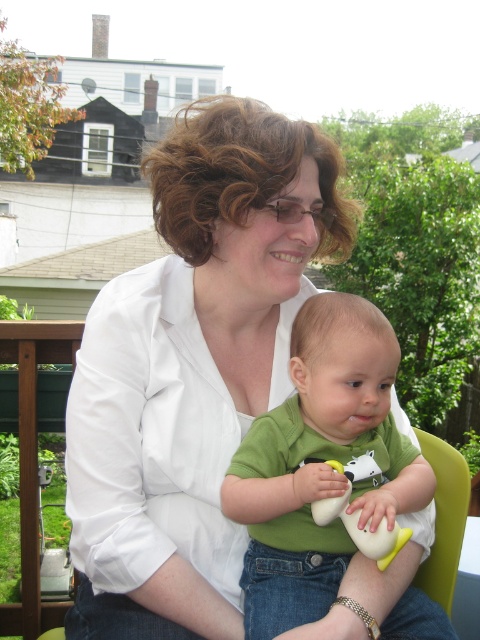
You are a photographer trying to capture a closeup of the white rubber duck at center without the green matte shirt at center blocking it. What should you do?

The green matte shirt at center is in front of the white rubber duck at center, so you should move the green matte shirt at center out of the way or adjust your angle to avoid the obstruction.

You are a photographer trying to capture a photo of the baby. You notice the white smooth shirt at center and the green matte shirt at center in the frame. Which shirt should you adjust to avoid blocking the baby?

The white smooth shirt at center is positioned on the left side of the green matte shirt at center. To avoid blocking the baby, adjust the white smooth shirt at center since it is closer to the left edge and might be overlapping the baby.